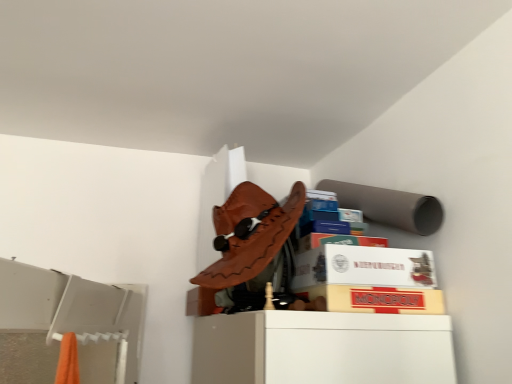
Question: Is matte yellow monopoly box at center, the 1th cardboard box positioned from the bottom, shorter than white cardboard box at upper center, the 1th cardboard box from the top?

Choices:
 (A) no
 (B) yes

Answer: (B)

Question: Would you consider matte yellow monopoly box at center, the 1th cardboard box positioned from the bottom, to be distant from white cardboard box at upper center, the second cardboard box when ordered from bottom to top?

Choices:
 (A) yes
 (B) no

Answer: (B)

Question: Is matte yellow monopoly box at center, the 1th cardboard box positioned from the bottom, smaller than white cardboard box at upper center, the second cardboard box when ordered from bottom to top?

Choices:
 (A) no
 (B) yes

Answer: (B)

Question: Could you tell me if matte yellow monopoly box at center, the second cardboard box from the top, is facing white cardboard box at upper center, the second cardboard box when ordered from bottom to top?

Choices:
 (A) yes
 (B) no

Answer: (B)

Question: Is the surface of matte yellow monopoly box at center, the second cardboard box from the top, in direct contact with white cardboard box at upper center, the second cardboard box when ordered from bottom to top?

Choices:
 (A) no
 (B) yes

Answer: (B)

Question: Can white cardboard box at upper center, the second cardboard box when ordered from bottom to top, be found inside matte yellow monopoly box at center, the second cardboard box from the top?

Choices:
 (A) yes
 (B) no

Answer: (B)

Question: Is white cardboard box at upper center, the 1th cardboard box from the top, smaller than matte yellow monopoly box at center, the second cardboard box from the top?

Choices:
 (A) yes
 (B) no

Answer: (B)

Question: From a real-world perspective, is white cardboard box at upper center, the second cardboard box when ordered from bottom to top, located beneath matte yellow monopoly box at center, the second cardboard box from the top?

Choices:
 (A) yes
 (B) no

Answer: (B)

Question: Is white cardboard box at upper center, the second cardboard box when ordered from bottom to top, not close to matte yellow monopoly box at center, the 1th cardboard box positioned from the bottom?

Choices:
 (A) no
 (B) yes

Answer: (A)

Question: Is white cardboard box at upper center, the 1th cardboard box from the top, facing away from matte yellow monopoly box at center, the 1th cardboard box positioned from the bottom?

Choices:
 (A) no
 (B) yes

Answer: (A)

Question: Is white cardboard box at upper center, the second cardboard box when ordered from bottom to top, to the right of matte yellow monopoly box at center, the second cardboard box from the top, from the viewer's perspective?

Choices:
 (A) no
 (B) yes

Answer: (A)

Question: From the image's perspective, is white cardboard box at upper center, the second cardboard box when ordered from bottom to top, located above matte yellow monopoly box at center, the second cardboard box from the top?

Choices:
 (A) no
 (B) yes

Answer: (B)

Question: From a real-world perspective, is matte yellow monopoly box at center, the 1th cardboard box positioned from the bottom, positioned above or below white cardboard box at upper center, the 1th cardboard box from the top?

Choices:
 (A) above
 (B) below

Answer: (B)